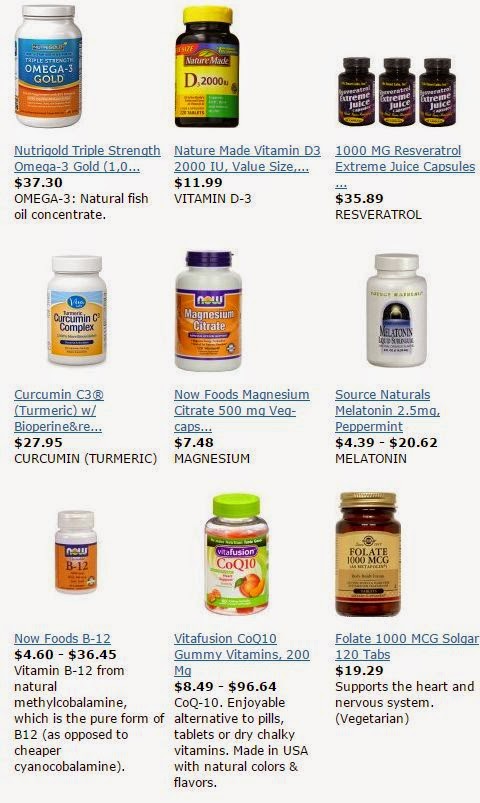
You are a GUI agent. You are given a task and a screenshot of the screen. Output one action in this format:
    pyautogui.click(x=<x>, y=<y>)
    Task: Click on the white plastic jar
    Image resolution: width=480 pixels, height=803 pixels.
    Given the screenshot: What is the action you would take?
    pyautogui.click(x=72, y=540), pyautogui.click(x=382, y=316), pyautogui.click(x=203, y=286), pyautogui.click(x=85, y=283), pyautogui.click(x=58, y=26)